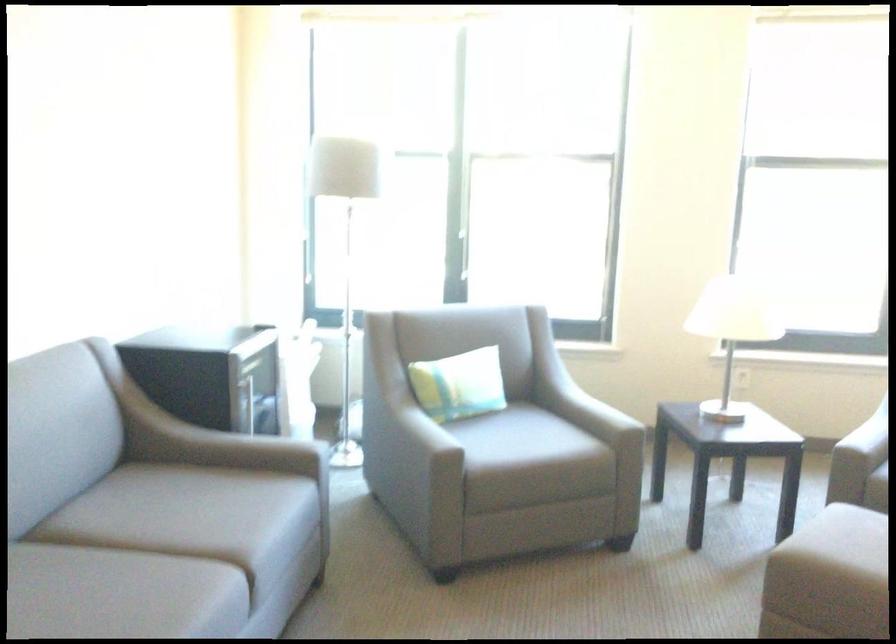
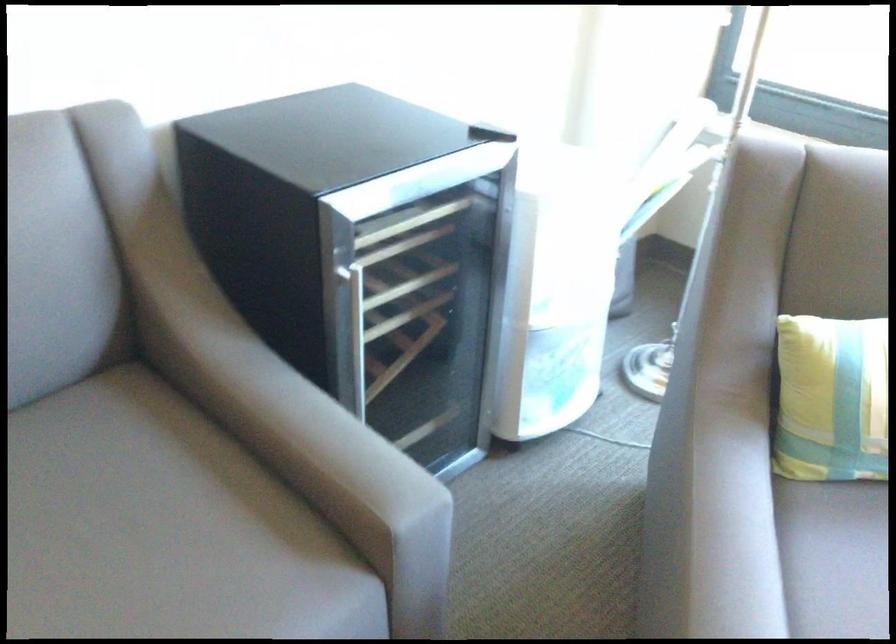
Where in the second image is the point corresponding to (x=394, y=386) from the first image?

(831, 399)